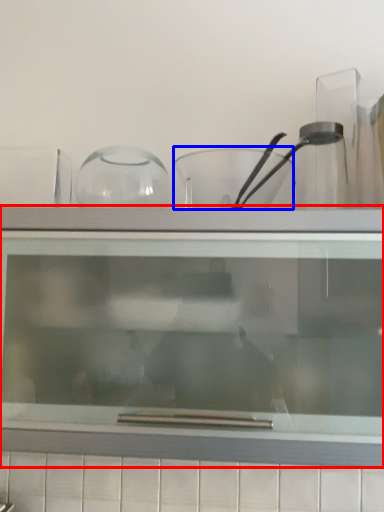
Question: Which of the following is the farthest to the observer, shelf (highlighted by a red box) or bowl (highlighted by a blue box)?

Choices:
 (A) shelf
 (B) bowl

Answer: (B)